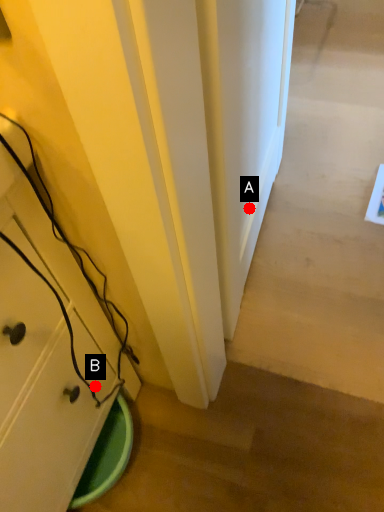
Question: Two points are circled on the image, labeled by A and B beside each circle. Which point appears farthest from the camera in this image?

Choices:
 (A) A is further
 (B) B is further

Answer: (A)